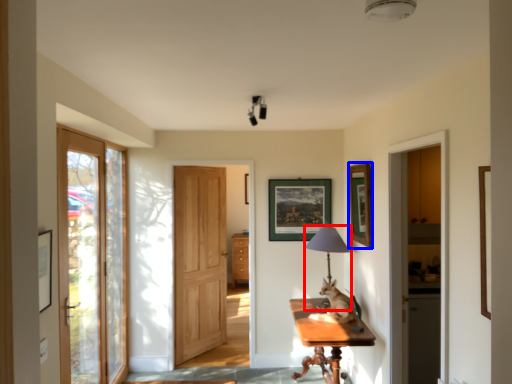
Question: Among these objects, which one is farthest to the camera, table lamp (highlighted by a red box) or picture frame (highlighted by a blue box)?

Choices:
 (A) table lamp
 (B) picture frame

Answer: (A)